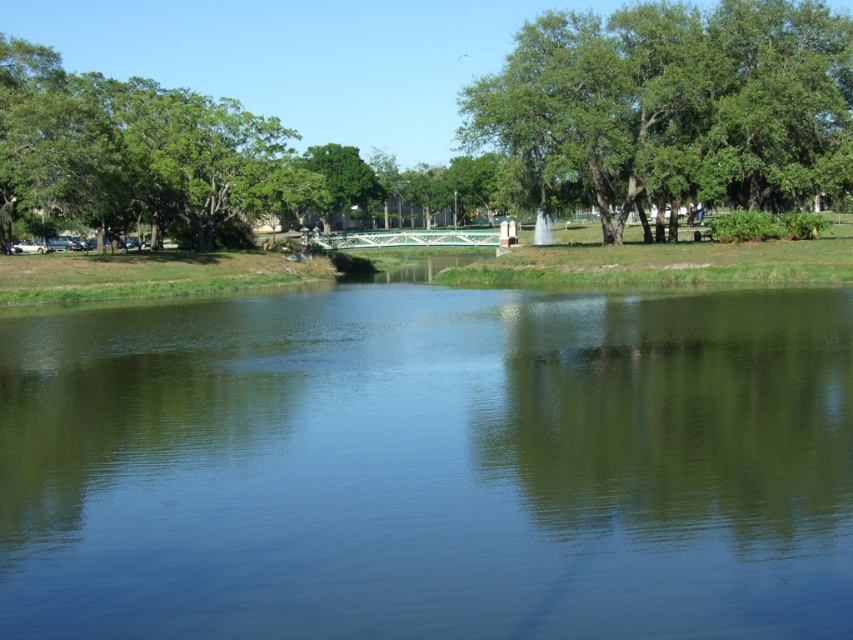
Can you confirm if green reflective water at center is wider than green leafy tree at upper left?

No, green reflective water at center is not wider than green leafy tree at upper left.

Which of these two, green reflective water at center or green leafy tree at upper left, stands taller?

green leafy tree at upper left

Is point (590, 304) more distant than point (102, 208)?

No, (590, 304) is in front of (102, 208).

Identify the location of green reflective water at center. (428, 465).

Who is higher up, green reflective water at center or green leafy tree at upper right?

green leafy tree at upper right is above.

Which is in front, point (115, 451) or point (746, 88)?

Positioned in front is point (115, 451).

In order to click on green reflective water at center in this screenshot , I will do coord(428,465).

Is green leafy tree at upper right thinner than green leafy tree at upper left?

Yes, green leafy tree at upper right is thinner than green leafy tree at upper left.

Is green leafy tree at upper right in front of green leafy tree at upper left?

Yes, it is.

Identify the location of green leafy tree at upper right. (672, 106).